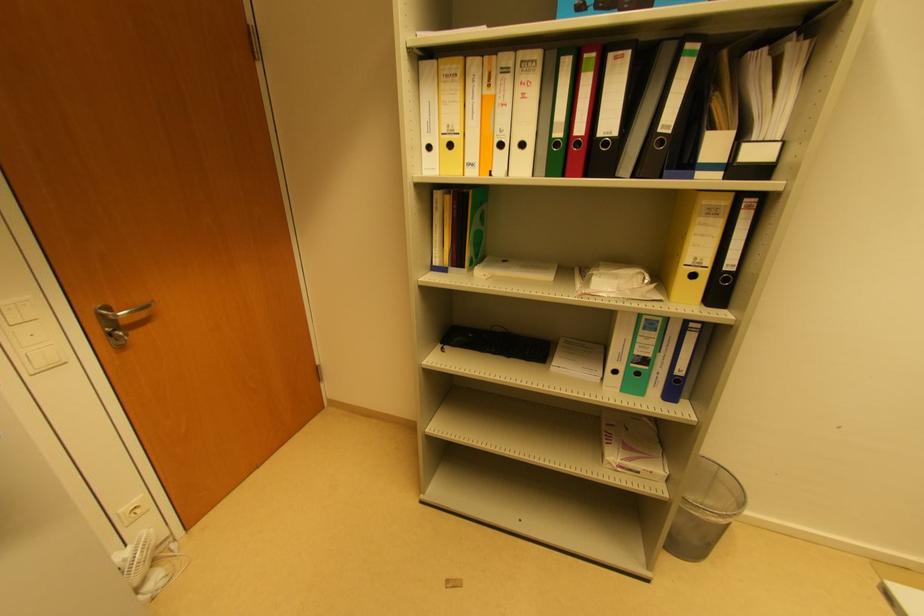
Find where to lift the black keyboard. Please return your answer as a coordinate pair (x, y).

(496, 342)